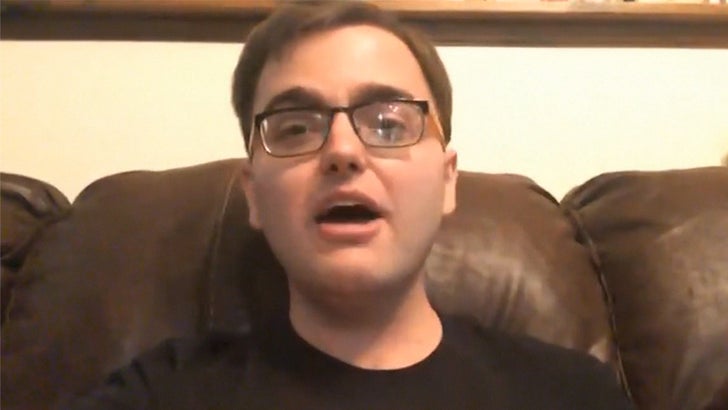
This screenshot has width=728, height=410. Identify the location of tan wall. (560, 118).